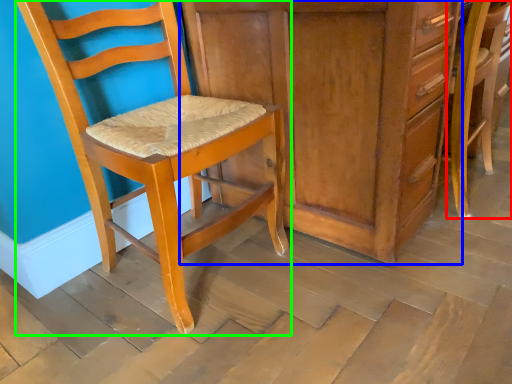
Question: Which object is positioned farthest from chair (highlighted by a red box)? Select from cabinetry (highlighted by a blue box) and chair (highlighted by a green box).

Choices:
 (A) cabinetry
 (B) chair

Answer: (B)